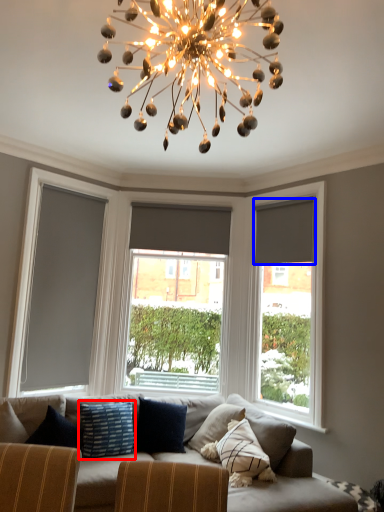
Question: Which object is closer to the camera taking this photo, pillow (highlighted by a red box) or curtain (highlighted by a blue box)?

Choices:
 (A) pillow
 (B) curtain

Answer: (A)